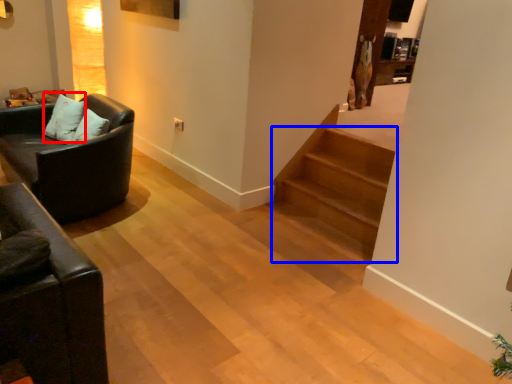
Question: Among these objects, which one is farthest to the camera, pillow (highlighted by a red box) or stairs (highlighted by a blue box)?

Choices:
 (A) pillow
 (B) stairs

Answer: (A)